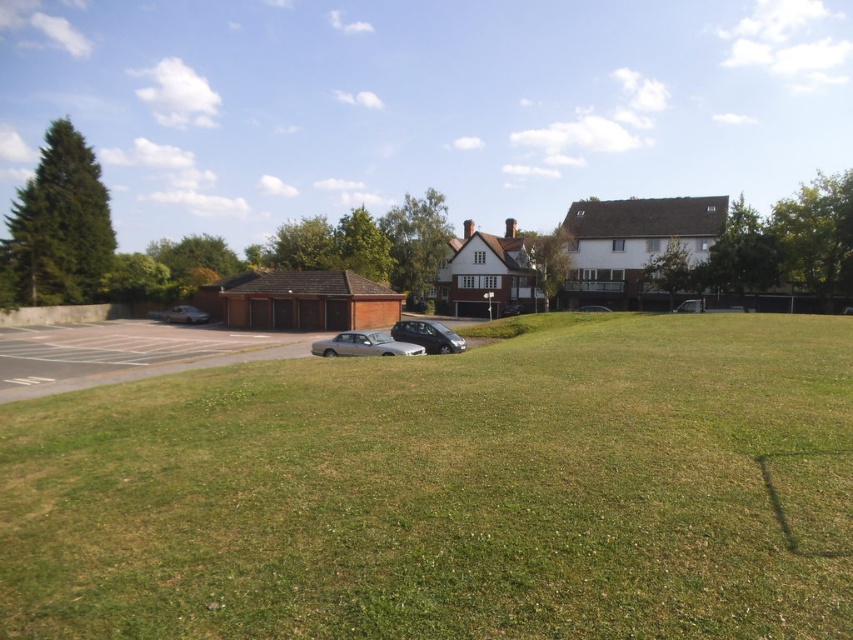
You are standing at the edge of the grassy field in the suburban scene. You see two metallic silver cars in the parking lot. How far apart are the metallic silver car at left and the metallic silver car at center?

The metallic silver car at left is 129.94 feet away from the metallic silver car at center.

You are a delivery person trying to park your van between the metallic silver car at left and the metallic silver car at center. The van is 2.5 meters wide. Can you fit your van between them?

The metallic silver car at left might be wider than metallic silver car at center, so the space between them could vary. Without exact measurements, it is uncertain if the van will fit.